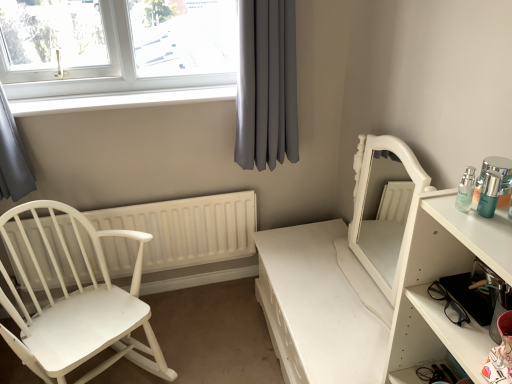
Image resolution: width=512 pixels, height=384 pixels. I want to click on free spot to the right of white wood chair at left, so (212, 329).